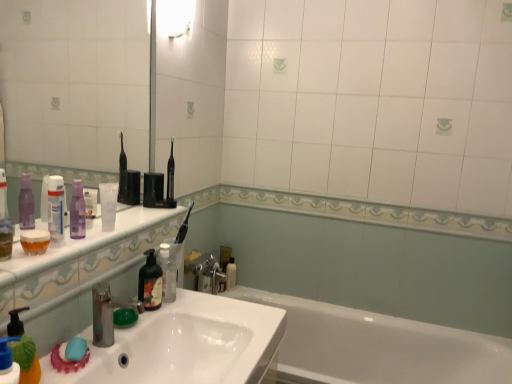
Identify the location of free area in between black plastic toothbrush at upper center and white matte tube at center, arranged as the 1th mouthwash when viewed from the left. (138, 220).